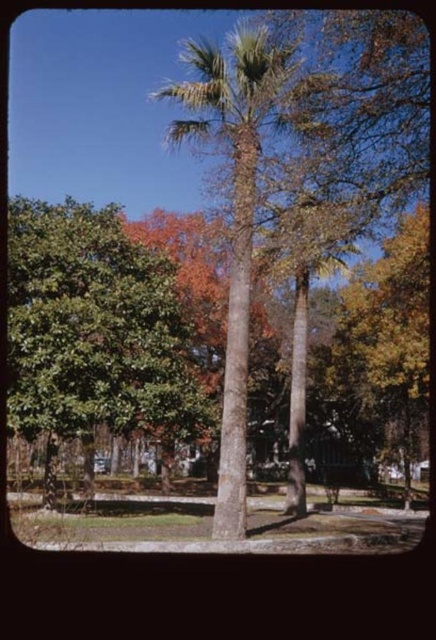
Is green leafy tree at left wider than smooth brown palm tree at center?

No.

Is point (30, 388) positioned in front of point (232, 64)?

No.

Locate an element on the screen. Image resolution: width=436 pixels, height=640 pixels. green leafy tree at left is located at coordinates (94, 330).